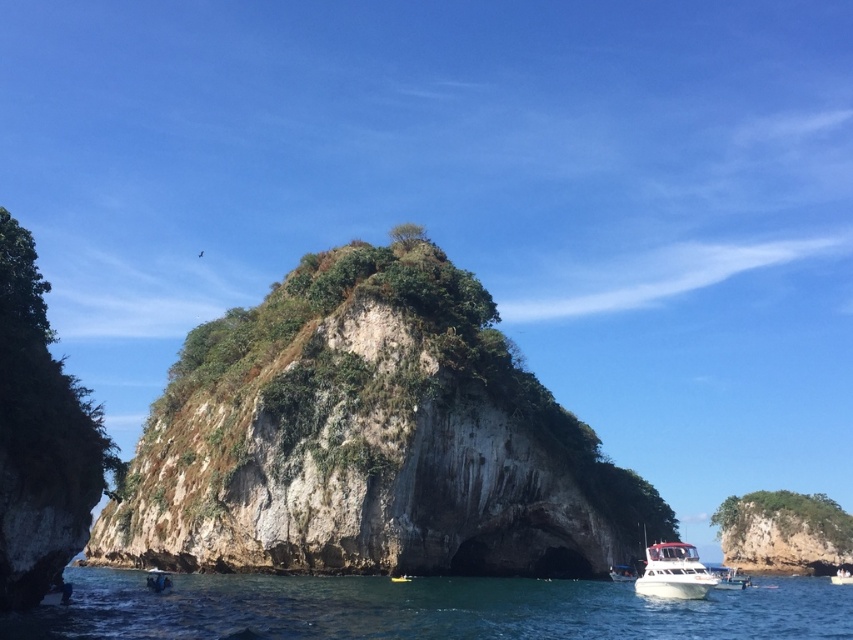
Is rough stone cliff at center smaller than white glossy boat at lower center?

Actually, rough stone cliff at center might be larger than white glossy boat at lower center.

Who is more distant from viewer, (238, 500) or (689, 595)?

Positioned behind is point (238, 500).

Locate an element on the screen. rough stone cliff at center is located at coordinates (370, 440).

Which of these two, clear blue water at lower center or white glossy boat at lower center, stands shorter?

white glossy boat at lower center

Which is in front, point (590, 632) or point (648, 566)?

Point (590, 632) is more forward.

I want to click on clear blue water at lower center, so click(424, 609).

Is rough stone cliff at center smaller than clear blue water at lower center?

Yes.

Is point (515, 557) positioned before point (540, 620)?

No, it is not.

Is point (177, 486) positioned before point (177, 596)?

No, it is behind (177, 596).

You are a GUI agent. You are given a task and a screenshot of the screen. Output one action in this format:
    pyautogui.click(x=<x>, y=<y>)
    Task: Click on the rough stone cliff at center
    
    Given the screenshot: What is the action you would take?
    pyautogui.click(x=370, y=440)